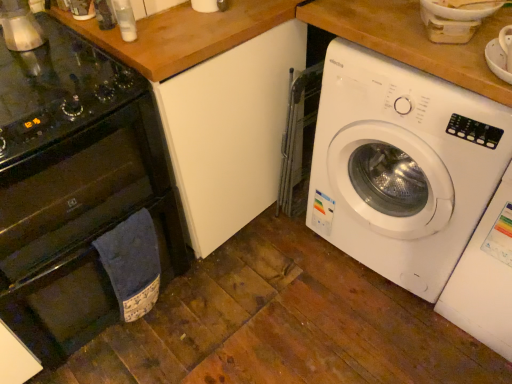
Describe the element at coordinates (81, 229) in the screenshot. This screenshot has height=384, width=512. I see `black glass oven at left` at that location.

How much space does white plastic washing machine at right, the 2th washing machine from the right, occupy vertically?

The height of white plastic washing machine at right, the 2th washing machine from the right, is 36.07 inches.

Locate an element on the screen. Image resolution: width=512 pixels, height=384 pixels. black glass gas stove at left is located at coordinates (57, 90).

Is white plastic washing machine at right, the 2th washing machine from the right, situated inside black glass oven at left or outside?

white plastic washing machine at right, the 2th washing machine from the right, is outside black glass oven at left.

From the image's perspective, does white plastic washing machine at right, the 1th washing machine viewed from the left, appear lower than black glass oven at left?

No.

Considering the sizes of objects white plastic washing machine at right, the 2th washing machine from the right, and black glass oven at left in the image provided, who is taller, white plastic washing machine at right, the 2th washing machine from the right, or black glass oven at left?

Standing taller between the two is white plastic washing machine at right, the 2th washing machine from the right.

Between black glass oven at left and black glass gas stove at left, which one appears on the right side from the viewer's perspective?

From the viewer's perspective, black glass gas stove at left appears more on the right side.

Is point (13, 206) farther from camera compared to point (95, 89)?

Yes, it is.

From a real-world perspective, is black glass oven at left on black glass gas stove at left?

No, from a real-world perspective, black glass oven at left is not above black glass gas stove at left.

Which is behind, black glass oven at left or black glass gas stove at left?

black glass gas stove at left is further from the camera.

Could you measure the distance between white plastic washing machine at right, the 2th washing machine viewed from the left, and metallic silver kettle at upper left?

white plastic washing machine at right, the 2th washing machine viewed from the left, is 1.48 meters from metallic silver kettle at upper left.

Between white plastic washing machine at right, the 2th washing machine viewed from the left, and metallic silver kettle at upper left, which one has smaller width?

metallic silver kettle at upper left.

From the metallic silver kettle at upper left, count 2nd washing machine to the right and point to it. Please provide its 2D coordinates.

[(485, 277)]

This screenshot has width=512, height=384. In order to click on gas stove above the white plastic washing machine at right, the 2th washing machine from the right (from the image's perspective) in this screenshot , I will do (57, 90).

Which is correct: white plastic washing machine at right, the 2th washing machine from the right, is inside black glass gas stove at left, or outside of it?

white plastic washing machine at right, the 2th washing machine from the right, is located beyond the bounds of black glass gas stove at left.

In the scene shown: Is white plastic washing machine at right, the 2th washing machine from the right, thinner than black glass gas stove at left?

Incorrect, the width of white plastic washing machine at right, the 2th washing machine from the right, is not less than that of black glass gas stove at left.

Which object is further away from the camera taking this photo, black glass oven at left or white plastic washing machine at right, the 2th washing machine from the right?

Positioned behind is white plastic washing machine at right, the 2th washing machine from the right.

Can you confirm if black glass oven at left is positioned to the right of white plastic washing machine at right, the 2th washing machine from the right?

In fact, black glass oven at left is to the left of white plastic washing machine at right, the 2th washing machine from the right.

Identify the location of washing machine that appears above the black glass oven at left (from a real-world perspective). The width and height of the screenshot is (512, 384). point(402,166).

From a real-world perspective, which object stands above the other?

In real-world perspective, white plastic washing machine at right, the 2th washing machine from the right, is above.

Is black glass gas stove at left outside of white plastic washing machine at right, the first washing machine viewed from the right?

black glass gas stove at left is positioned outside white plastic washing machine at right, the first washing machine viewed from the right.

Consider the image. From the image's perspective, does black glass gas stove at left appear lower than white plastic washing machine at right, the 2th washing machine viewed from the left?

No, from the image's perspective, black glass gas stove at left is not below white plastic washing machine at right, the 2th washing machine viewed from the left.

Is black glass gas stove at left positioned far away from white plastic washing machine at right, the 2th washing machine viewed from the left?

Yes, black glass gas stove at left and white plastic washing machine at right, the 2th washing machine viewed from the left, are located far from each other.

Considering the relative sizes of black glass gas stove at left and white plastic washing machine at right, the 2th washing machine viewed from the left, in the image provided, is black glass gas stove at left thinner than white plastic washing machine at right, the 2th washing machine viewed from the left,?

No, black glass gas stove at left is not thinner than white plastic washing machine at right, the 2th washing machine viewed from the left.

From a real-world perspective, which is physically above, metallic silver kettle at upper left or black glass gas stove at left?

metallic silver kettle at upper left.

Which is in front, metallic silver kettle at upper left or black glass gas stove at left?

black glass gas stove at left is more forward.

Based on the photo, is metallic silver kettle at upper left far from black glass gas stove at left?

metallic silver kettle at upper left is near black glass gas stove at left, not far away.

In order to click on washing machine above the black glass oven at left (from a real-world perspective) in this screenshot , I will do `click(402, 166)`.

The width and height of the screenshot is (512, 384). I want to click on oven below the black glass gas stove at left (from the image's perspective), so click(x=81, y=229).

Which object lies nearer to the anchor point metallic silver kettle at upper left, black glass gas stove at left or white plastic washing machine at right, the 2th washing machine from the right?

Based on the image, black glass gas stove at left appears to be nearer to metallic silver kettle at upper left.

Estimate the real-world distances between objects in this image. Which object is further from black glass gas stove at left, white plastic washing machine at right, the 1th washing machine viewed from the left, or metallic silver kettle at upper left?

white plastic washing machine at right, the 1th washing machine viewed from the left, lies further to black glass gas stove at left than the other object.

Considering their positions, is white plastic washing machine at right, the 2th washing machine viewed from the left, positioned further to white plastic washing machine at right, the 2th washing machine from the right, than black glass oven at left?

black glass oven at left lies further to white plastic washing machine at right, the 2th washing machine from the right, than the other object.

Estimate the real-world distances between objects in this image. Which object is further from black glass oven at left, black glass gas stove at left or metallic silver kettle at upper left?

Based on the image, metallic silver kettle at upper left appears to be further to black glass oven at left.

Considering their positions, is black glass gas stove at left positioned further to metallic silver kettle at upper left than white plastic washing machine at right, the first washing machine viewed from the right?

white plastic washing machine at right, the first washing machine viewed from the right, lies further to metallic silver kettle at upper left than the other object.

Looking at this image, from the image, which object appears to be farther from black glass oven at left, white plastic washing machine at right, the 1th washing machine viewed from the left, or metallic silver kettle at upper left?

Based on the image, white plastic washing machine at right, the 1th washing machine viewed from the left, appears to be further to black glass oven at left.

Which object lies nearer to the anchor point white plastic washing machine at right, the 2th washing machine from the right, white plastic washing machine at right, the first washing machine viewed from the right, or black glass gas stove at left?

The object closer to white plastic washing machine at right, the 2th washing machine from the right, is white plastic washing machine at right, the first washing machine viewed from the right.

Looking at the image, which one is located further to metallic silver kettle at upper left, white plastic washing machine at right, the first washing machine viewed from the right, or black glass oven at left?

white plastic washing machine at right, the first washing machine viewed from the right, lies further to metallic silver kettle at upper left than the other object.

At what (x,y) coordinates should I click in order to perform the action: click on gas stove that lies between metallic silver kettle at upper left and black glass oven at left from top to bottom. Please return your answer as a coordinate pair (x, y). Looking at the image, I should click on (57, 90).

The image size is (512, 384). Find the location of `appliance between black glass oven at left and white plastic washing machine at right, the 2th washing machine viewed from the left`. appliance between black glass oven at left and white plastic washing machine at right, the 2th washing machine viewed from the left is located at coordinates (20, 26).

The height and width of the screenshot is (384, 512). I want to click on gas stove between black glass oven at left and white plastic washing machine at right, the first washing machine viewed from the right, so click(x=57, y=90).

Find the location of `washing machine between metallic silver kettle at upper left and white plastic washing machine at right, the 2th washing machine viewed from the left, from left to right`. washing machine between metallic silver kettle at upper left and white plastic washing machine at right, the 2th washing machine viewed from the left, from left to right is located at coordinates (402, 166).